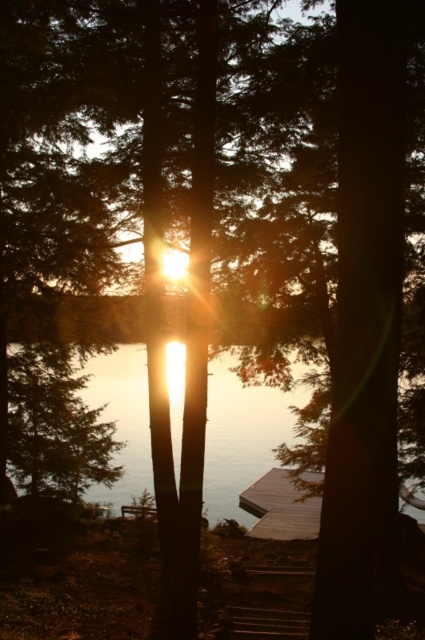
Question: Is translucent glass water at center above wooden dock at lower center?

Choices:
 (A) no
 (B) yes

Answer: (B)

Question: Which point is farther to the camera?

Choices:
 (A) wooden dock at lower center
 (B) translucent glass water at center

Answer: (A)

Question: Does translucent glass water at center appear on the left side of wooden dock at lower center?

Choices:
 (A) no
 (B) yes

Answer: (B)

Question: Which point is closer to the camera taking this photo?

Choices:
 (A) (209, 380)
 (B) (282, 496)

Answer: (B)

Question: Is translucent glass water at center smaller than wooden dock at lower center?

Choices:
 (A) no
 (B) yes

Answer: (A)